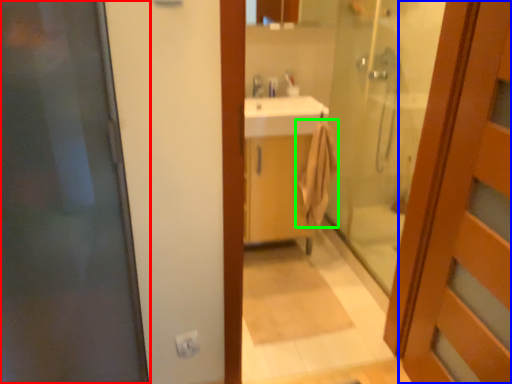
Question: Based on their relative distances, which object is farther from door (highlighted by a red box)? Choose from door (highlighted by a blue box) and bath towel (highlighted by a green box).

Choices:
 (A) door
 (B) bath towel

Answer: (B)